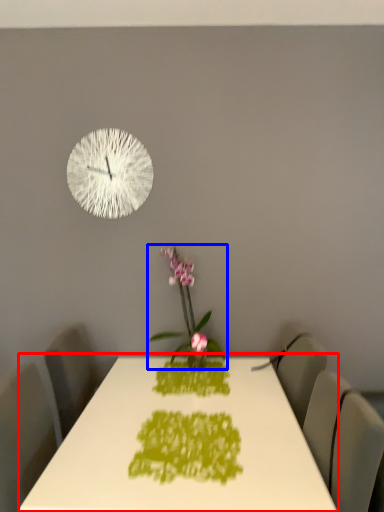
Question: Which object is closer to the camera taking this photo, table (highlighted by a red box) or houseplant (highlighted by a blue box)?

Choices:
 (A) table
 (B) houseplant

Answer: (A)